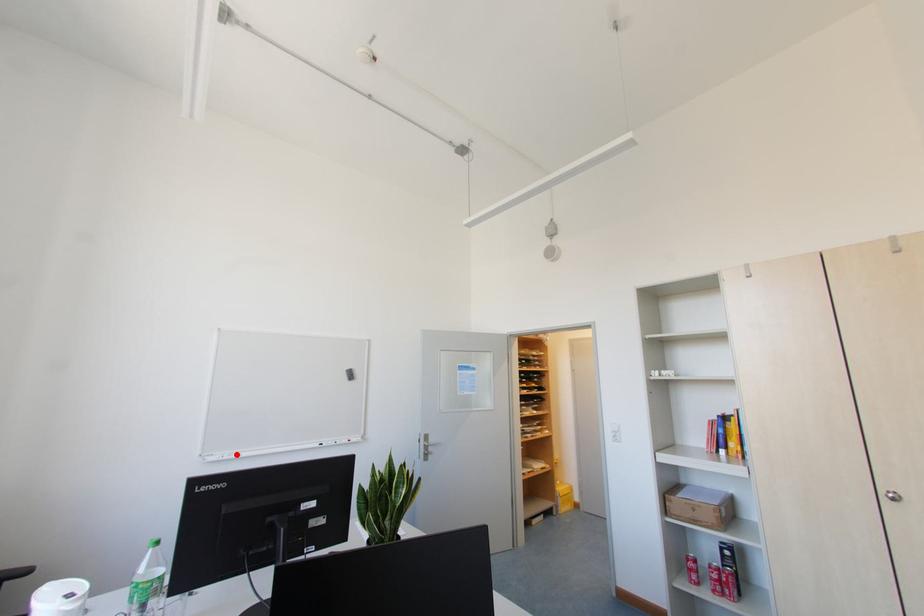
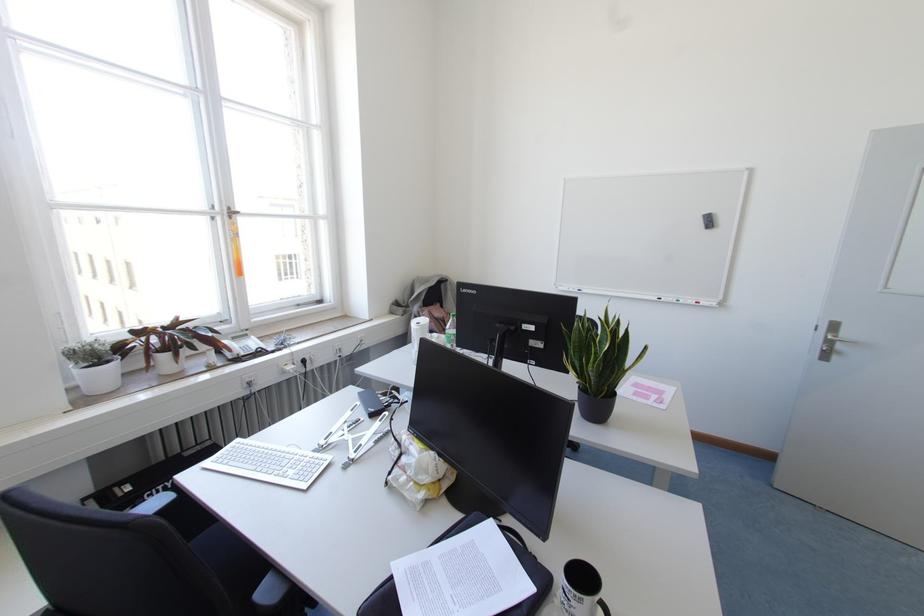
In the second image, find the point that corresponds to the highlighted location in the first image.

(578, 290)